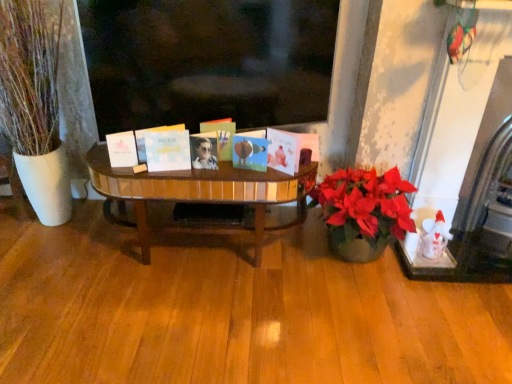
Question: Would you consider white matte book at center, the first book from the right, to be distant from white matte card at center, positioned as the second book in left-to-right order?

Choices:
 (A) yes
 (B) no

Answer: (B)

Question: Can you confirm if white matte book at center, the first book from the right, is bigger than white matte card at center, positioned as the second book in left-to-right order?

Choices:
 (A) yes
 (B) no

Answer: (B)

Question: Considering the relative positions of white matte book at center, the first book from the right, and white matte card at center, the 4th book from the right, in the image provided, is white matte book at center, the first book from the right, to the right of white matte card at center, the 4th book from the right, from the viewer's perspective?

Choices:
 (A) no
 (B) yes

Answer: (B)

Question: Is white matte book at center, the first book from the right, completely or partially outside of white matte card at center, positioned as the second book in left-to-right order?

Choices:
 (A) yes
 (B) no

Answer: (A)

Question: From a real-world perspective, does white matte book at center, the fifth book viewed from the left, sit lower than white matte card at center, positioned as the second book in left-to-right order?

Choices:
 (A) yes
 (B) no

Answer: (A)

Question: Is metallic photo album at center, placed as the 3th book when sorted from left to right, to the left or to the right of white matte book at center, the fifth book viewed from the left, in the image?

Choices:
 (A) left
 (B) right

Answer: (A)

Question: From a real-world perspective, relative to white matte book at center, the fifth book viewed from the left, is metallic photo album at center, placed as the 3th book when sorted from left to right, vertically above or below?

Choices:
 (A) below
 (B) above

Answer: (B)

Question: From the image's perspective, relative to white matte book at center, the first book from the right, is metallic photo album at center, placed as the 3th book when sorted from left to right, above or below?

Choices:
 (A) above
 (B) below

Answer: (A)

Question: Considering the positions of point (224, 130) and point (285, 165), is point (224, 130) closer or farther from the camera than point (285, 165)?

Choices:
 (A) closer
 (B) farther

Answer: (B)

Question: From the image's perspective, relative to matte blue card at center, arranged as the 4th book when viewed from the left, is matte black sunglasses at center above or below?

Choices:
 (A) above
 (B) below

Answer: (B)

Question: Considering their positions, is matte black sunglasses at center located in front of or behind matte blue card at center, arranged as the 4th book when viewed from the left?

Choices:
 (A) behind
 (B) front

Answer: (A)

Question: Looking at their shapes, would you say matte black sunglasses at center is wider or thinner than matte blue card at center, arranged as the 2th book when viewed from the right?

Choices:
 (A) wide
 (B) thin

Answer: (B)

Question: From a real-world perspective, is matte black sunglasses at center physically located above or below matte blue card at center, arranged as the 2th book when viewed from the right?

Choices:
 (A) below
 (B) above

Answer: (A)

Question: From the image's perspective, is matte blue card at center, arranged as the 2th book when viewed from the right, above or below white matte book at center, the first book from the right?

Choices:
 (A) below
 (B) above

Answer: (B)

Question: Would you say matte blue card at center, arranged as the 4th book when viewed from the left, is inside or outside white matte book at center, the first book from the right?

Choices:
 (A) outside
 (B) inside

Answer: (A)